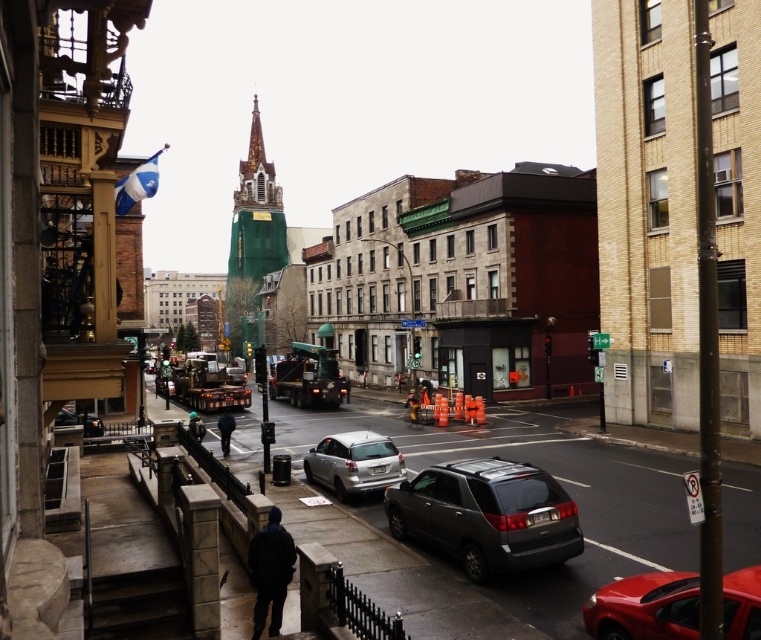
Question: Does shiny red car at lower right have a smaller size compared to satin silver car at center?

Choices:
 (A) yes
 (B) no

Answer: (A)

Question: Which point appears farthest from the camera in this image?

Choices:
 (A) (263, 577)
 (B) (377, 444)
 (C) (228, 381)
 (D) (454, 525)

Answer: (C)

Question: Can you confirm if matte gray suv at center is positioned to the right of satin silver car at center?

Choices:
 (A) yes
 (B) no

Answer: (A)

Question: Does satin silver car at center have a greater width compared to dark blue fabric construction worker at lower center?

Choices:
 (A) yes
 (B) no

Answer: (A)

Question: Among these objects, which one is farthest from the camera?

Choices:
 (A) satin silver car at center
 (B) shiny red car at lower right
 (C) matte black truck at center

Answer: (C)

Question: Which is nearer to the dark blue fabric construction worker at lower center?

Choices:
 (A) matte black truck at center
 (B) satin silver car at center
 (C) shiny red car at lower right
 (D) matte gray suv at center

Answer: (D)